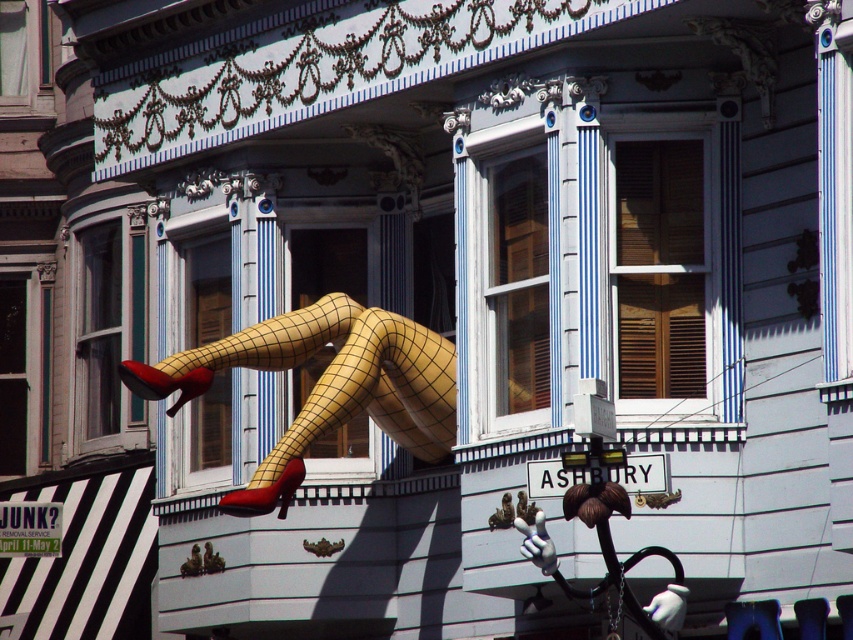
Is yellow mesh legs at center to the right of matte yellow shoe at center from the viewer's perspective?

Correct, you'll find yellow mesh legs at center to the right of matte yellow shoe at center.

Where is `yellow mesh legs at center`? Image resolution: width=853 pixels, height=640 pixels. yellow mesh legs at center is located at coordinates (323, 385).

Is point (262, 362) more distant than point (248, 502)?

Yes, point (262, 362) is farther from viewer.

Identify the location of yellow mesh legs at center. Image resolution: width=853 pixels, height=640 pixels. (323, 385).

Between shiny red high-heeled shoe at left and matte yellow shoe at center, which one is positioned lower?

matte yellow shoe at center is below.

At what (x,y) coordinates should I click in order to perform the action: click on shiny red high-heeled shoe at left. Please return your answer as a coordinate pair (x, y). Looking at the image, I should click on (163, 381).

Identify the location of yellow mesh legs at center. (323, 385).

What do you see at coordinates (323, 385) in the screenshot? I see `yellow mesh legs at center` at bounding box center [323, 385].

Identify the location of yellow mesh legs at center. (323, 385).